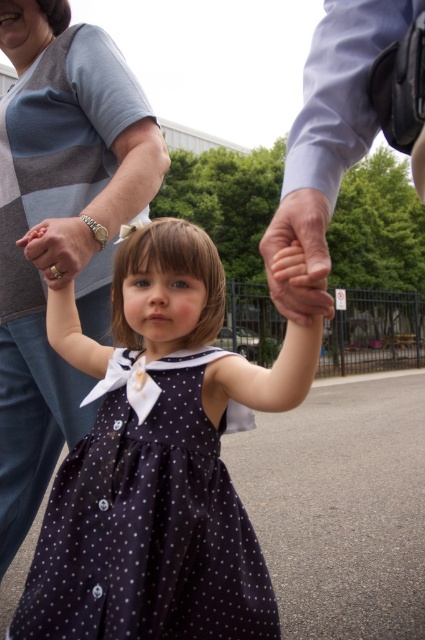
Does light blue shirt at upper right have a smaller size compared to matte gold ring at center?

No.

Is light blue shirt at upper right above matte gold ring at center?

Yes, light blue shirt at upper right is above matte gold ring at center.

In the scene shown: Measure the distance between light blue shirt at upper right and camera.

A distance of 27.29 inches exists between light blue shirt at upper right and camera.

The width and height of the screenshot is (425, 640). Identify the location of light blue shirt at upper right. (328, 140).

Can you confirm if matte gray sweater at upper left is bigger than smooth skin hand at center?

Correct, matte gray sweater at upper left is larger in size than smooth skin hand at center.

You are a GUI agent. You are given a task and a screenshot of the screen. Output one action in this format:
    pyautogui.click(x=<x>, y=<y>)
    Task: Click on the matte gray sweater at upper left
    The image size is (425, 640).
    Given the screenshot: What is the action you would take?
    pyautogui.click(x=59, y=228)

Image resolution: width=425 pixels, height=640 pixels. In order to click on matte gray sweater at upper left in this screenshot , I will do `click(59, 228)`.

Is point (65, 253) more distant than point (294, 212)?

Yes, point (65, 253) is behind point (294, 212).

You are a GUI agent. You are given a task and a screenshot of the screen. Output one action in this format:
    pyautogui.click(x=<x>, y=<y>)
    Task: Click on the matte gray sweater at upper left
    The height and width of the screenshot is (640, 425).
    Given the screenshot: What is the action you would take?
    pyautogui.click(x=59, y=228)